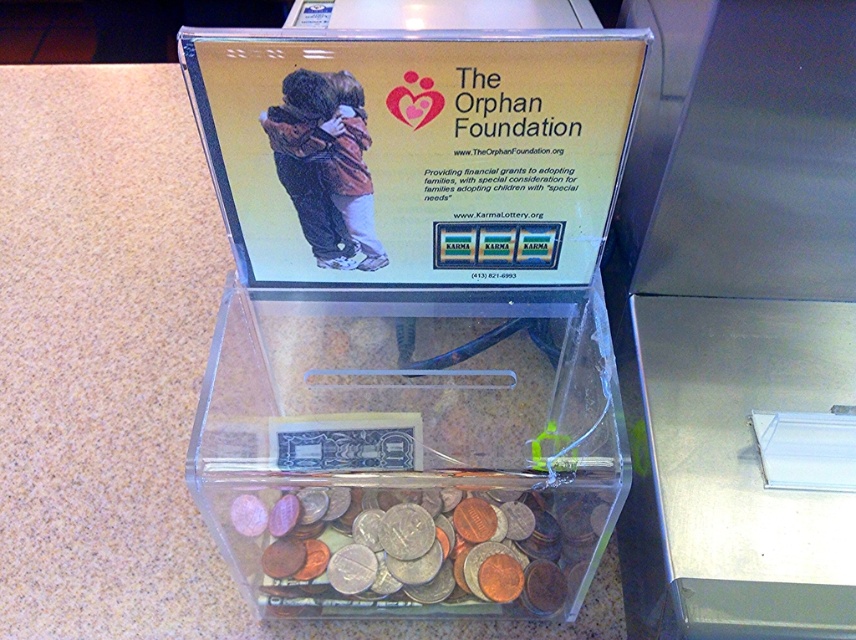
Question: Which point appears farthest from the camera in this image?

Choices:
 (A) (557, 321)
 (B) (550, 496)

Answer: (A)

Question: Which of the following is the closest to the observer?

Choices:
 (A) transparent plastic box at center
 (B) shiny metallic coins at center

Answer: (A)

Question: Is transparent plastic box at center in front of shiny metallic coins at center?

Choices:
 (A) yes
 (B) no

Answer: (A)

Question: Is transparent plastic box at center closer to the viewer compared to shiny metallic coins at center?

Choices:
 (A) no
 (B) yes

Answer: (B)

Question: Among these objects, which one is farthest from the camera?

Choices:
 (A) shiny metallic coins at center
 (B) transparent plastic box at center

Answer: (A)

Question: From the image, what is the correct spatial relationship of transparent plastic box at center in relation to shiny metallic coins at center?

Choices:
 (A) left
 (B) right

Answer: (A)